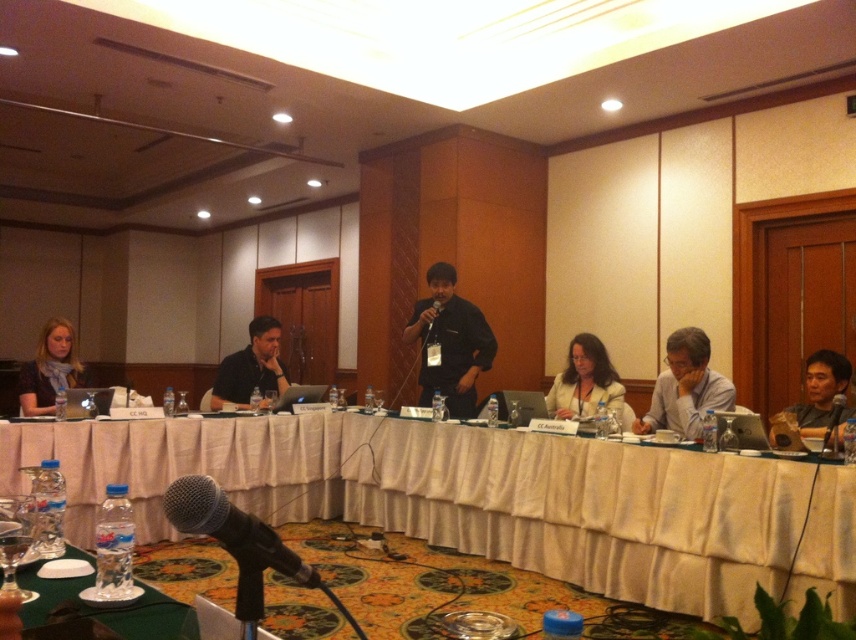
You are a speaker at a conference and need to place your notes on the table between the matte black laptop at right and the black matte microphone at center. Can you fit your notes there?

The matte black laptop at right is to the right of the black matte microphone at center, so there is space between them where you can place your notes.

You are sitting at the table and want to hand a document to the person wearing the black shirt at center. The matte black laptop at right is blocking your path. Can you reach the person without moving the laptop?

The black shirt at center is further to the viewer than the matte black laptop at right, so you can reach them without moving the laptop because the laptop is behind the person.